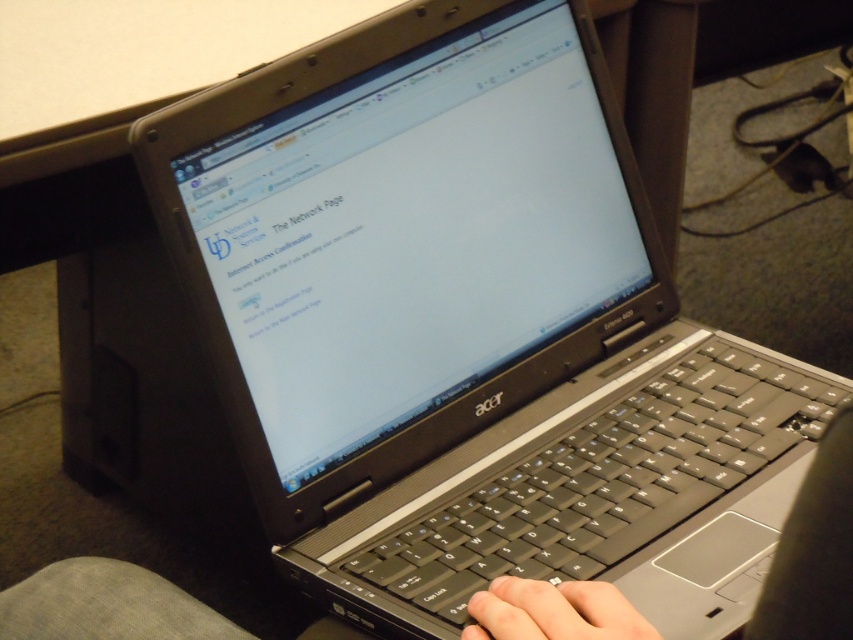
What do you see at coordinates (814, 548) in the screenshot? I see `black matte keyboard at center` at bounding box center [814, 548].

Does black matte keyboard at center appear on the right side of skinny white hand at lower center?

Incorrect, black matte keyboard at center is not on the right side of skinny white hand at lower center.

Which is behind, point (624, 625) or point (531, 636)?

Point (531, 636)

The height and width of the screenshot is (640, 853). Identify the location of black matte keyboard at center. (814, 548).